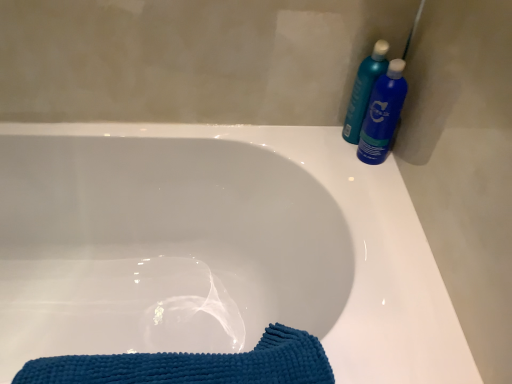
Question: Is blue textured towel at lower left outside of white glossy bathtub at center?

Choices:
 (A) no
 (B) yes

Answer: (A)

Question: Is blue textured towel at lower left oriented towards white glossy bathtub at center?

Choices:
 (A) yes
 (B) no

Answer: (A)

Question: From the image's perspective, would you say blue textured towel at lower left is shown under white glossy bathtub at center?

Choices:
 (A) yes
 (B) no

Answer: (A)

Question: Is there a large distance between blue textured towel at lower left and white glossy bathtub at center?

Choices:
 (A) no
 (B) yes

Answer: (A)

Question: From the image's perspective, is blue textured towel at lower left on white glossy bathtub at center?

Choices:
 (A) yes
 (B) no

Answer: (B)

Question: Is blue textured towel at lower left further to the viewer compared to white glossy bathtub at center?

Choices:
 (A) no
 (B) yes

Answer: (B)

Question: From the image's perspective, would you say blue glossy bottle at upper right, which ranks as the 1th cleaning product in right-to-left order, is positioned over white glossy bathtub at center?

Choices:
 (A) yes
 (B) no

Answer: (A)

Question: Is blue glossy bottle at upper right, arranged as the second cleaning product when viewed from the left, bigger than white glossy bathtub at center?

Choices:
 (A) yes
 (B) no

Answer: (B)

Question: Is blue glossy bottle at upper right, which ranks as the 1th cleaning product in right-to-left order, thinner than white glossy bathtub at center?

Choices:
 (A) no
 (B) yes

Answer: (B)

Question: Considering the relative positions of blue glossy bottle at upper right, arranged as the second cleaning product when viewed from the left, and white glossy bathtub at center in the image provided, is blue glossy bottle at upper right, arranged as the second cleaning product when viewed from the left, behind white glossy bathtub at center?

Choices:
 (A) no
 (B) yes

Answer: (B)

Question: From the image's perspective, is blue glossy bottle at upper right, which ranks as the 1th cleaning product in right-to-left order, located beneath white glossy bathtub at center?

Choices:
 (A) no
 (B) yes

Answer: (A)

Question: Is blue glossy bottle at upper right, arranged as the second cleaning product when viewed from the left, far away from white glossy bathtub at center?

Choices:
 (A) yes
 (B) no

Answer: (B)

Question: Considering the relative positions of white glossy bathtub at center and blue glossy bottle at upper right, which ranks as the 1th cleaning product in right-to-left order, in the image provided, is white glossy bathtub at center to the left of blue glossy bottle at upper right, which ranks as the 1th cleaning product in right-to-left order, from the viewer's perspective?

Choices:
 (A) yes
 (B) no

Answer: (A)